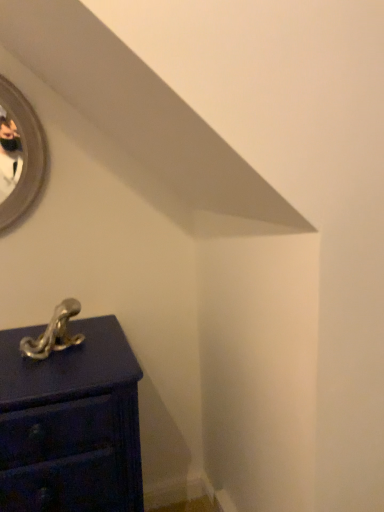
What do you see at coordinates (54, 333) in the screenshot? I see `polished silver hook at lower left` at bounding box center [54, 333].

In order to click on polished silver hook at lower left in this screenshot , I will do `click(54, 333)`.

You are a GUI agent. You are given a task and a screenshot of the screen. Output one action in this format:
    pyautogui.click(x=<x>, y=<y>)
    Task: Click on the matte dark blue chest of drawers at lower left
    This screenshot has height=512, width=384.
    Given the screenshot: What is the action you would take?
    (71, 423)

The height and width of the screenshot is (512, 384). What do you see at coordinates (71, 423) in the screenshot?
I see `matte dark blue chest of drawers at lower left` at bounding box center [71, 423].

Identify the location of polished silver hook at lower left. This screenshot has width=384, height=512. (54, 333).

Which is more to the right, polished silver hook at lower left or matte dark blue chest of drawers at lower left?

From the viewer's perspective, matte dark blue chest of drawers at lower left appears more on the right side.

Considering the positions of objects polished silver hook at lower left and matte dark blue chest of drawers at lower left in the image provided, who is behind, polished silver hook at lower left or matte dark blue chest of drawers at lower left?

polished silver hook at lower left is more distant.

Which is in front, point (76, 309) or point (45, 428)?

Point (45, 428)

From the image's perspective, which is below, polished silver hook at lower left or matte dark blue chest of drawers at lower left?

matte dark blue chest of drawers at lower left.

From a real-world perspective, who is located higher, polished silver hook at lower left or matte dark blue chest of drawers at lower left?

In real-world perspective, polished silver hook at lower left is above.

Considering the sizes of polished silver hook at lower left and matte dark blue chest of drawers at lower left in the image, is polished silver hook at lower left wider or thinner than matte dark blue chest of drawers at lower left?

Considering their sizes, polished silver hook at lower left looks slimmer than matte dark blue chest of drawers at lower left.

Which of these two, polished silver hook at lower left or matte dark blue chest of drawers at lower left, stands taller?

matte dark blue chest of drawers at lower left is taller.

Is polished silver hook at lower left bigger than matte dark blue chest of drawers at lower left?

Incorrect, polished silver hook at lower left is not larger than matte dark blue chest of drawers at lower left.

Is matte dark blue chest of drawers at lower left surrounded by polished silver hook at lower left?

No, polished silver hook at lower left does not contain matte dark blue chest of drawers at lower left.

Is polished silver hook at lower left with matte dark blue chest of drawers at lower left?

There is a gap between polished silver hook at lower left and matte dark blue chest of drawers at lower left.

Could you tell me if polished silver hook at lower left is facing matte dark blue chest of drawers at lower left?

No, polished silver hook at lower left is not oriented towards matte dark blue chest of drawers at lower left.

The image size is (384, 512). In order to click on the chest of drawers lying in front of the polished silver hook at lower left in this screenshot , I will do `click(71, 423)`.

Is matte dark blue chest of drawers at lower left at the right side of polished silver hook at lower left?

Yes, matte dark blue chest of drawers at lower left is to the right of polished silver hook at lower left.

Which is behind, matte dark blue chest of drawers at lower left or polished silver hook at lower left?

polished silver hook at lower left is further away from the camera.

Which point is more distant from viewer, (25, 429) or (21, 347)?

The point (21, 347) is farther.

From the image's perspective, relative to polished silver hook at lower left, is matte dark blue chest of drawers at lower left above or below?

Based on their image positions, matte dark blue chest of drawers at lower left is located beneath polished silver hook at lower left.

From a real-world perspective, is matte dark blue chest of drawers at lower left positioned over polished silver hook at lower left based on gravity?

No, from a real-world perspective, matte dark blue chest of drawers at lower left is not on top of polished silver hook at lower left.

Considering the relative sizes of matte dark blue chest of drawers at lower left and polished silver hook at lower left in the image provided, is matte dark blue chest of drawers at lower left thinner than polished silver hook at lower left?

No, matte dark blue chest of drawers at lower left is not thinner than polished silver hook at lower left.

Which of these two, matte dark blue chest of drawers at lower left or polished silver hook at lower left, stands taller?

Standing taller between the two is matte dark blue chest of drawers at lower left.

Which of these two, matte dark blue chest of drawers at lower left or polished silver hook at lower left, is smaller?

With smaller size is polished silver hook at lower left.

Which is correct: matte dark blue chest of drawers at lower left is inside polished silver hook at lower left, or outside of it?

matte dark blue chest of drawers at lower left is outside polished silver hook at lower left.

Looking at this image, is there a large distance between matte dark blue chest of drawers at lower left and polished silver hook at lower left?

They are positioned close to each other.

Could you tell me if matte dark blue chest of drawers at lower left is turned towards polished silver hook at lower left?

No, matte dark blue chest of drawers at lower left is not aimed at polished silver hook at lower left.

How many degrees apart are the facing directions of matte dark blue chest of drawers at lower left and polished silver hook at lower left?

The angular difference between matte dark blue chest of drawers at lower left and polished silver hook at lower left is 1.26 degrees.

I want to click on antique that is above the matte dark blue chest of drawers at lower left (from a real-world perspective), so click(54, 333).

Where is `chest of drawers below the polished silver hook at lower left (from the image's perspective)`? Image resolution: width=384 pixels, height=512 pixels. chest of drawers below the polished silver hook at lower left (from the image's perspective) is located at coordinates (71, 423).

Find the location of a particular element. chest of drawers that appears on the right of polished silver hook at lower left is located at coordinates (71, 423).